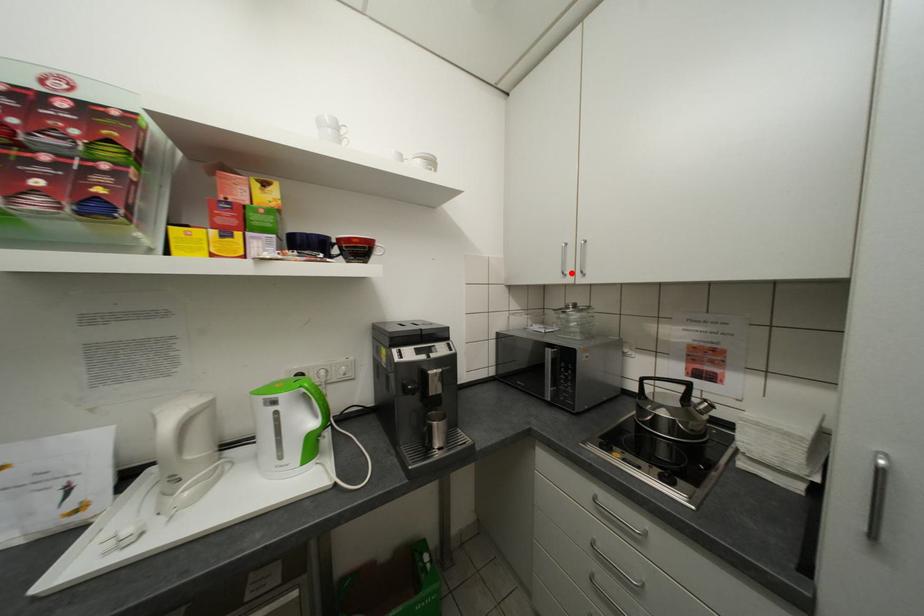
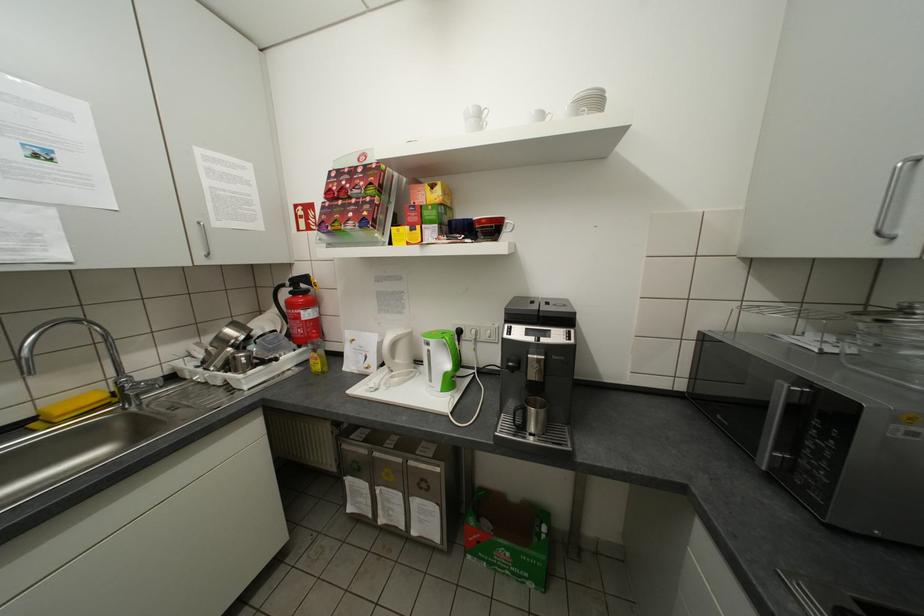
Locate, in the second image, the point that corresponds to the highlighted location in the first image.

(888, 233)